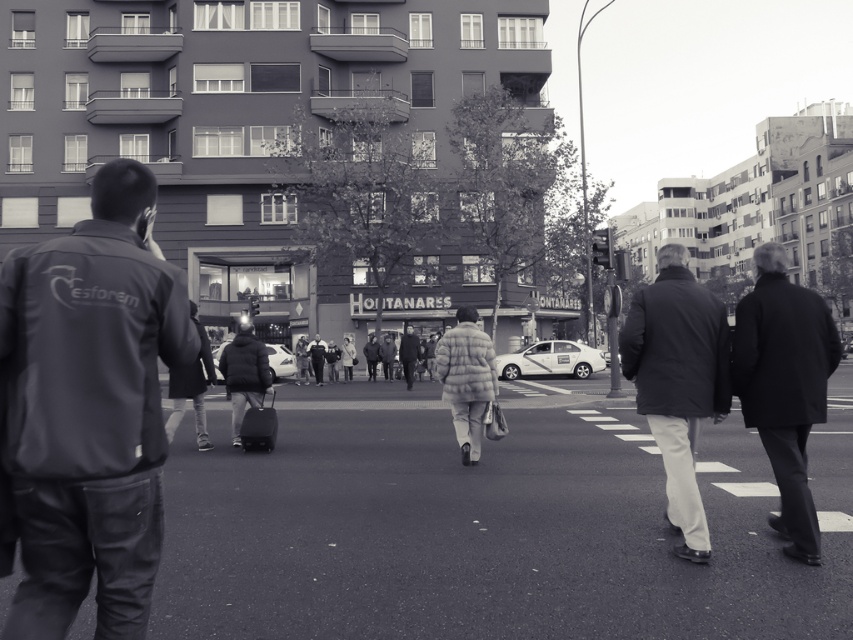
Can you confirm if dark gray jacket at left is positioned below light gray puffer jacket at center?

No.

What do you see at coordinates (90, 408) in the screenshot? I see `dark gray jacket at left` at bounding box center [90, 408].

Locate an element on the screen. The width and height of the screenshot is (853, 640). dark gray jacket at left is located at coordinates (90, 408).

Is the position of dark gray jacket at left less distant than that of dark gray jacket at center?

Yes, it is in front of dark gray jacket at center.

Is dark gray jacket at left above dark gray jacket at center?

Correct, dark gray jacket at left is located above dark gray jacket at center.

Where is `dark gray jacket at left`? This screenshot has width=853, height=640. dark gray jacket at left is located at coordinates (90, 408).

Is dark wool coat at right below light gray puffer jacket at center?

No, dark wool coat at right is not below light gray puffer jacket at center.

Is dark wool coat at right positioned in front of light gray puffer jacket at center?

Yes.

The image size is (853, 640). Find the location of `dark wool coat at right`. dark wool coat at right is located at coordinates (784, 385).